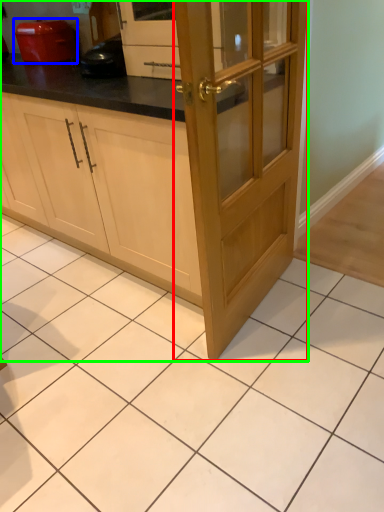
Question: Which is farther away from door (highlighted by a red box)? home appliance (highlighted by a blue box) or cabinetry (highlighted by a green box)?

Choices:
 (A) home appliance
 (B) cabinetry

Answer: (A)